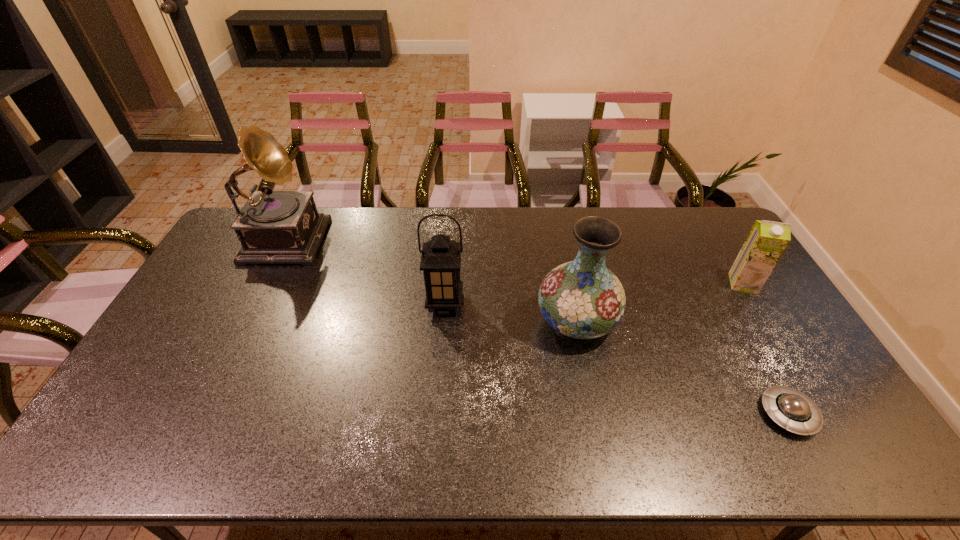
Image resolution: width=960 pixels, height=540 pixels. Find the location of `free region located on the front of the soya milk`. free region located on the front of the soya milk is located at coordinates (783, 349).

The image size is (960, 540). What are the coordinates of `free space located 0.340m on the left of the nearest object` in the screenshot? It's located at (628, 414).

You are a GUI agent. You are given a task and a screenshot of the screen. Output one action in this format:
    pyautogui.click(x=<x>, y=<y>)
    Task: Click on the object located at the far edge
    Image resolution: width=960 pixels, height=540 pixels.
    Given the screenshot: What is the action you would take?
    pyautogui.click(x=274, y=227)

The height and width of the screenshot is (540, 960). I want to click on object present at the near edge, so click(791, 409).

Locate an element on the screen. The height and width of the screenshot is (540, 960). object situated at the left edge is located at coordinates (274, 227).

This screenshot has height=540, width=960. Identify the location of soya milk present at the right edge. (765, 244).

You are a GUI agent. You are given a task and a screenshot of the screen. Output one action in this format:
    pyautogui.click(x=<x>, y=<y>)
    Task: Click on the saucer located at the right edge
    The width and height of the screenshot is (960, 540).
    Given the screenshot: What is the action you would take?
    pyautogui.click(x=791, y=409)

The image size is (960, 540). I want to click on object that is at the far left corner, so click(x=274, y=227).

The width and height of the screenshot is (960, 540). I want to click on object present at the near right corner, so click(791, 409).

The width and height of the screenshot is (960, 540). In the image, there is a desktop. In order to click on vacant space at the far edge in this screenshot , I will do `click(644, 212)`.